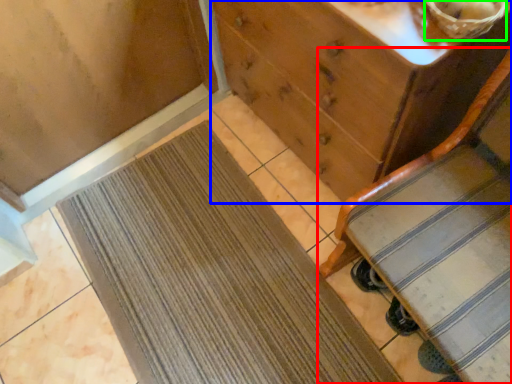
Question: Based on their relative distances, which object is nearer to furniture (highlighted by a red box)? Choose from chest of drawers (highlighted by a blue box) and basket (highlighted by a green box).

Choices:
 (A) chest of drawers
 (B) basket

Answer: (A)